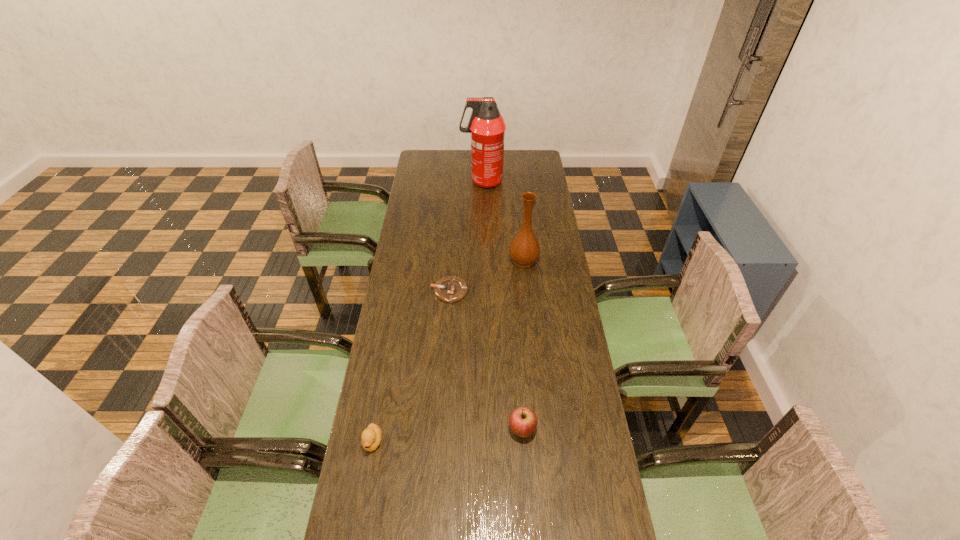
Where is `the tallest object`? the tallest object is located at coordinates (487, 127).

The image size is (960, 540). In order to click on fire extinguisher in this screenshot , I will do pos(487,127).

Locate an element on the screen. Image resolution: width=960 pixels, height=540 pixels. the fourth shortest object is located at coordinates (524, 249).

The image size is (960, 540). I want to click on the second farthest object, so click(x=524, y=249).

The height and width of the screenshot is (540, 960). Find the location of `apple`. apple is located at coordinates (522, 421).

Locate an element on the screen. This screenshot has height=540, width=960. duckling is located at coordinates (371, 437).

Where is `the fourth tallest object`? This screenshot has height=540, width=960. the fourth tallest object is located at coordinates (371, 437).

This screenshot has height=540, width=960. Identify the location of ashtray. (449, 289).

Find the location of a particular element. This screenshot has height=540, width=960. the shortest object is located at coordinates (449, 289).

You are a GUI agent. You are given a task and a screenshot of the screen. Output one action in this format:
    pyautogui.click(x=<x>, y=<y>)
    Task: Click on the blank space located on the trigger side of the fire extinguisher
    
    Given the screenshot: What is the action you would take?
    pyautogui.click(x=411, y=181)